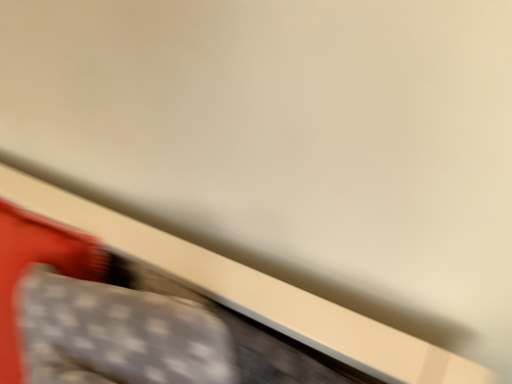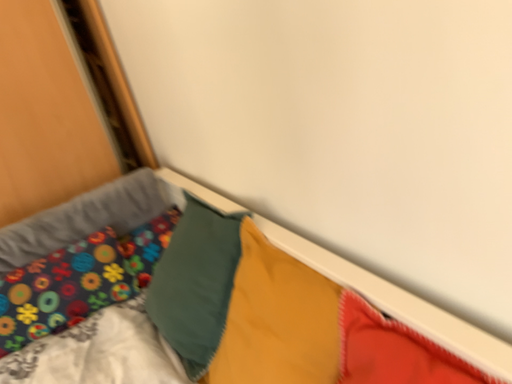
Question: How did the camera likely rotate when shooting the video?

Choices:
 (A) rotated upward
 (B) rotated downward

Answer: (A)